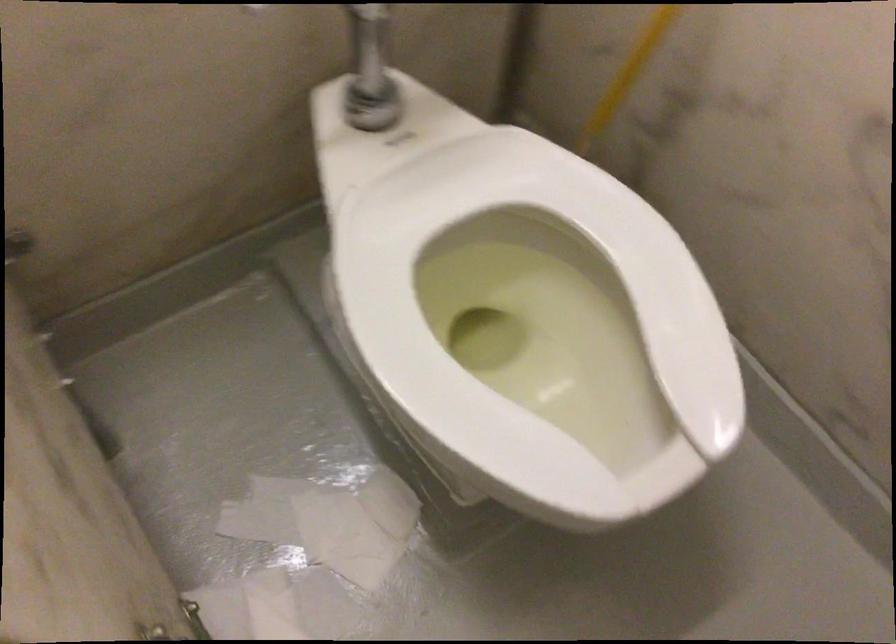
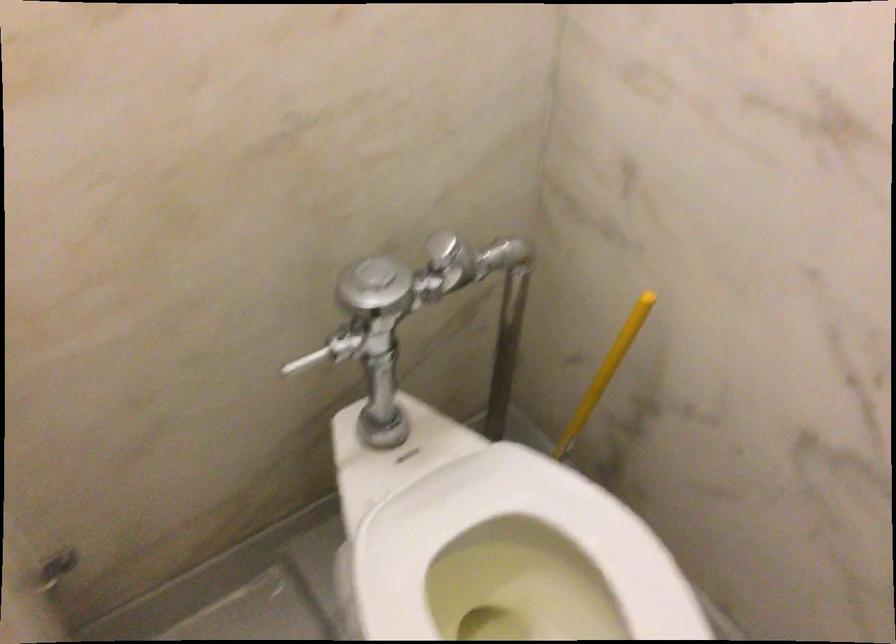
Question: Which direction would the cameraman need to move to produce the second image? Reply with the corresponding letter.

Choices:
 (A) Left
 (B) Right
 (C) Forward
 (D) Backward

Answer: (D)